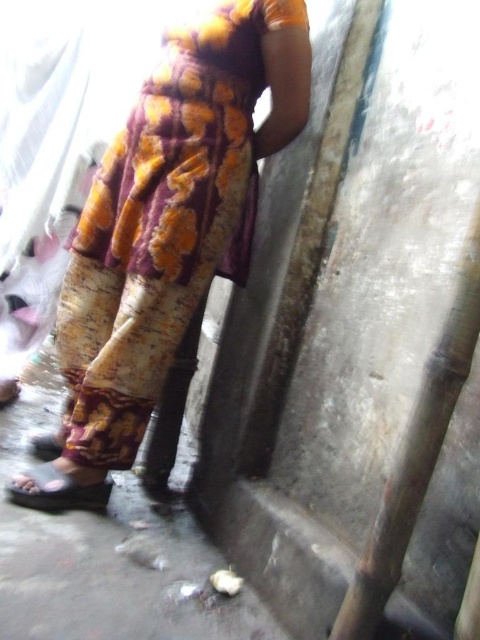
Question: Which of the following is the closest to the observer?

Choices:
 (A) (90, 492)
 (B) (123, 196)

Answer: (A)

Question: Which point appears closest to the camera in this image?

Choices:
 (A) (99, 500)
 (B) (83, 436)

Answer: (B)

Question: Does printed fabric dress at center have a greater width compared to matte black sandal at lower left?

Choices:
 (A) no
 (B) yes

Answer: (B)

Question: Is printed fabric dress at center positioned at the back of matte black sandal at lower left?

Choices:
 (A) no
 (B) yes

Answer: (A)

Question: Is printed fabric dress at center to the right of matte black sandal at lower left from the viewer's perspective?

Choices:
 (A) yes
 (B) no

Answer: (A)